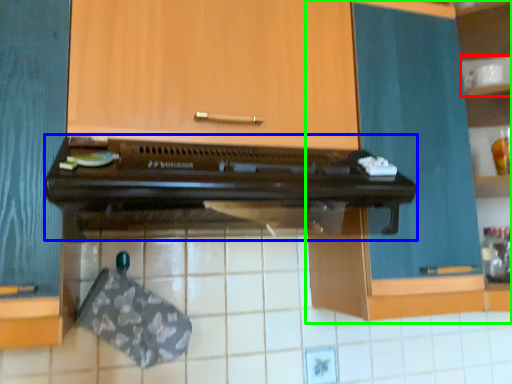
Question: Which object is positioned closest to shelf (highlighted by a red box)? Select from oven (highlighted by a blue box) and cabinetry (highlighted by a green box).

Choices:
 (A) oven
 (B) cabinetry

Answer: (B)